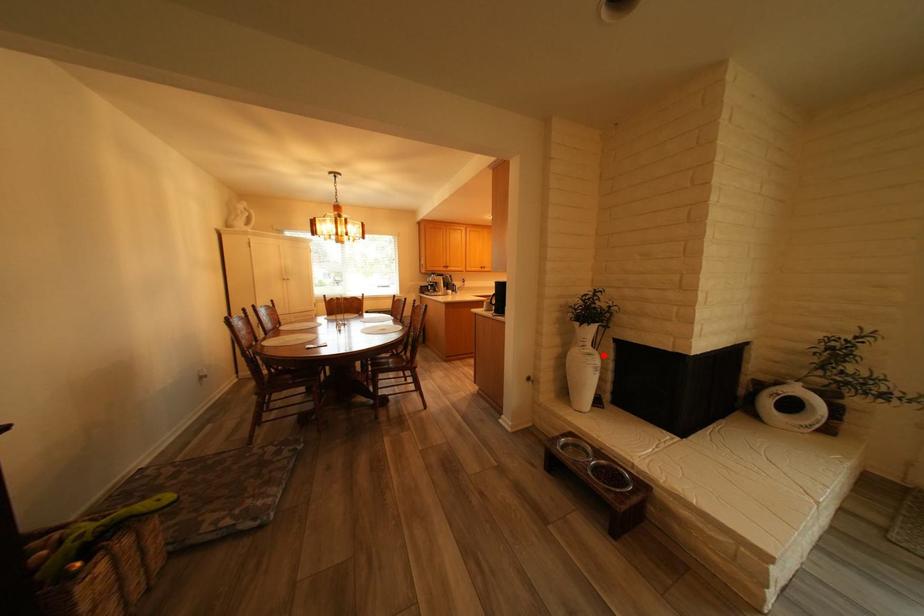
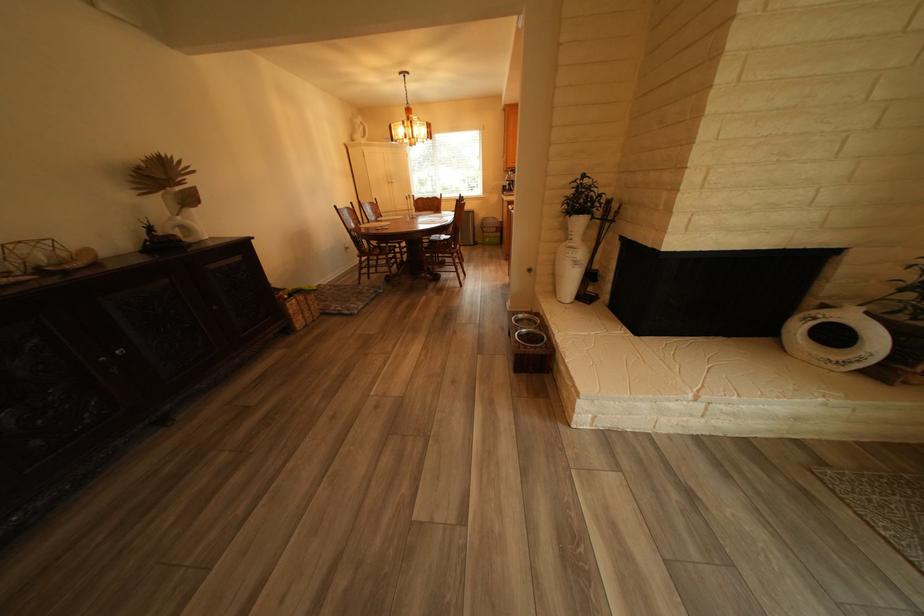
Question: I am providing you with two images of the same scene from different viewpoints. A red point is shown in image1. For the corresponding object point in image2, is it positioned nearer or farther from the camera?

Choices:
 (A) Nearer
 (B) Farther

Answer: (A)